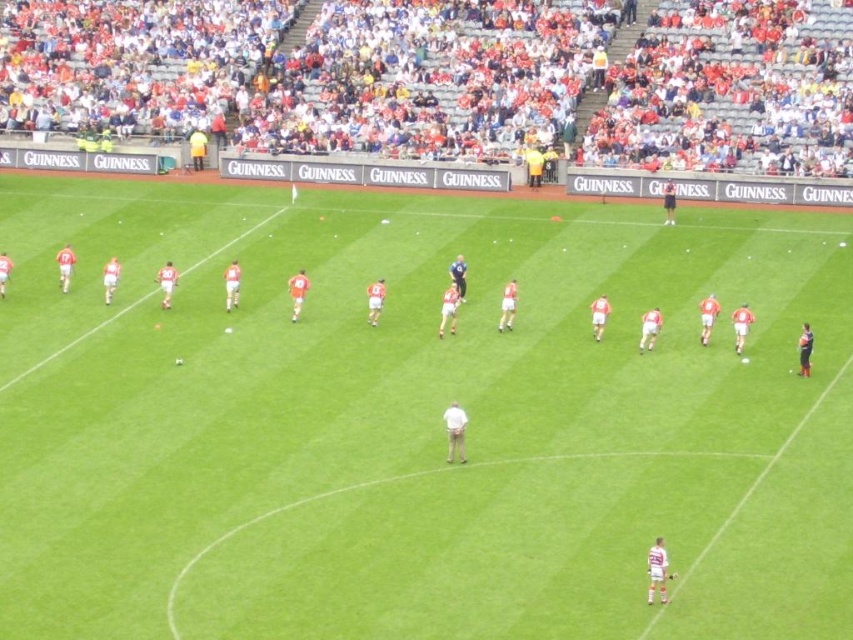
Can you confirm if white plastic seats at upper center is taller than white jersey at center?

Indeed, white plastic seats at upper center has a greater height compared to white jersey at center.

At what (x,y) coordinates should I click in order to perform the action: click on white plastic seats at upper center. Please return your answer as a coordinate pair (x, y). This screenshot has width=853, height=640. Looking at the image, I should click on (444, 77).

Can you confirm if white matte soccer ball at center is smaller than blue fabric jacket at center?

Correct, white matte soccer ball at center occupies less space than blue fabric jacket at center.

Does white matte soccer ball at center have a lesser width compared to blue fabric jacket at center?

Correct, white matte soccer ball at center's width is less than blue fabric jacket at center's.

Who is more forward, [448,445] or [453,268]?

Point [448,445]

Image resolution: width=853 pixels, height=640 pixels. What are the coordinates of `white matte soccer ball at center` in the screenshot? It's located at (456, 432).

Image resolution: width=853 pixels, height=640 pixels. In order to click on white jersey at center in this screenshot , I will do `click(74, 342)`.

Between white jersey at center and white matte soccer ball at center, which one is positioned higher?

white jersey at center

Who is more forward, (21, 376) or (456, 412)?

Point (456, 412) is in front.

This screenshot has height=640, width=853. Find the location of `white jersey at center`. white jersey at center is located at coordinates (74, 342).